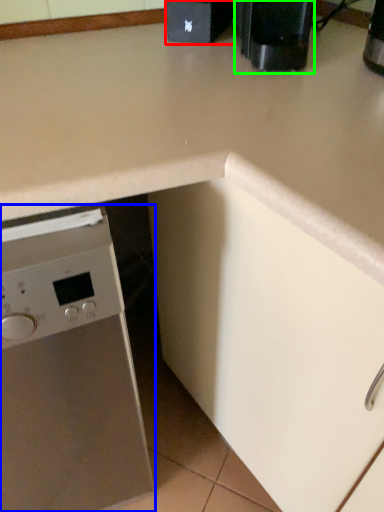
Question: Which object is the closest to the appliance (highlighted by a red box)? Choose among these: home appliance (highlighted by a blue box) or coffee machine (highlighted by a green box).

Choices:
 (A) home appliance
 (B) coffee machine

Answer: (B)